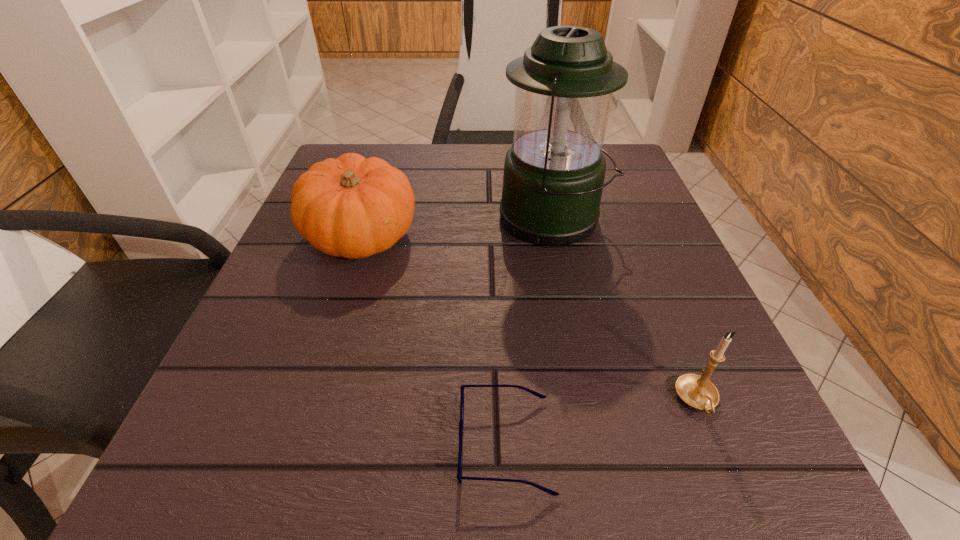
Identify the location of object at the far edge. The image size is (960, 540). (554, 172).

Locate an element on the screen. The width and height of the screenshot is (960, 540). object located at the near edge is located at coordinates (459, 475).

This screenshot has width=960, height=540. What are the coordinates of `object that is at the left edge` in the screenshot? It's located at (352, 207).

Locate an element on the screen. lantern positioned at the right edge is located at coordinates (554, 172).

Find the location of a particular element. candle holder located in the right edge section of the desktop is located at coordinates (697, 391).

Find the location of a particular element. object that is at the far right corner is located at coordinates (554, 172).

Locate an element on the screen. The image size is (960, 540). vacant region at the far edge of the desktop is located at coordinates (491, 168).

In order to click on free space at the near edge of the desktop in this screenshot , I will do `click(482, 440)`.

Identify the location of free point at the left edge. This screenshot has width=960, height=540. (289, 287).

Find the location of a particular element. free region at the right edge of the desktop is located at coordinates (655, 218).